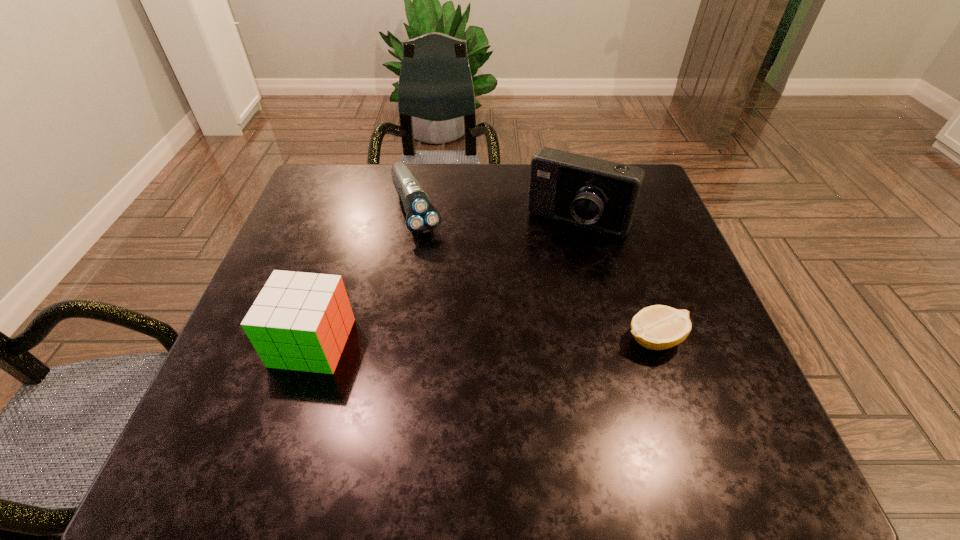
I want to click on cube, so click(x=300, y=321).

The height and width of the screenshot is (540, 960). I want to click on the leftmost object, so click(x=300, y=321).

Image resolution: width=960 pixels, height=540 pixels. What are the coordinates of `lemon` in the screenshot? It's located at (658, 327).

You are a GUI agent. You are given a task and a screenshot of the screen. Output one action in this format:
    pyautogui.click(x=<x>, y=<y>)
    Task: Click on the electric shaver
    This screenshot has height=540, width=960.
    Given the screenshot: What is the action you would take?
    [422, 217]

This screenshot has width=960, height=540. In order to click on the second object from left to right in this screenshot , I will do `click(422, 217)`.

This screenshot has height=540, width=960. What are the coordinates of `camera` in the screenshot? It's located at (595, 194).

Locate an element on the screen. The height and width of the screenshot is (540, 960). blank space located 0.070m on the back of the leftmost object is located at coordinates (330, 289).

Locate an element on the screen. vacant space positioned on the left of the shortest object is located at coordinates (492, 339).

Locate an element on the screen. The width and height of the screenshot is (960, 540). free space located on the head of the third tallest object is located at coordinates (481, 366).

Find the location of a particular element. This screenshot has width=960, height=540. vacant region located 0.280m on the head of the third tallest object is located at coordinates (462, 323).